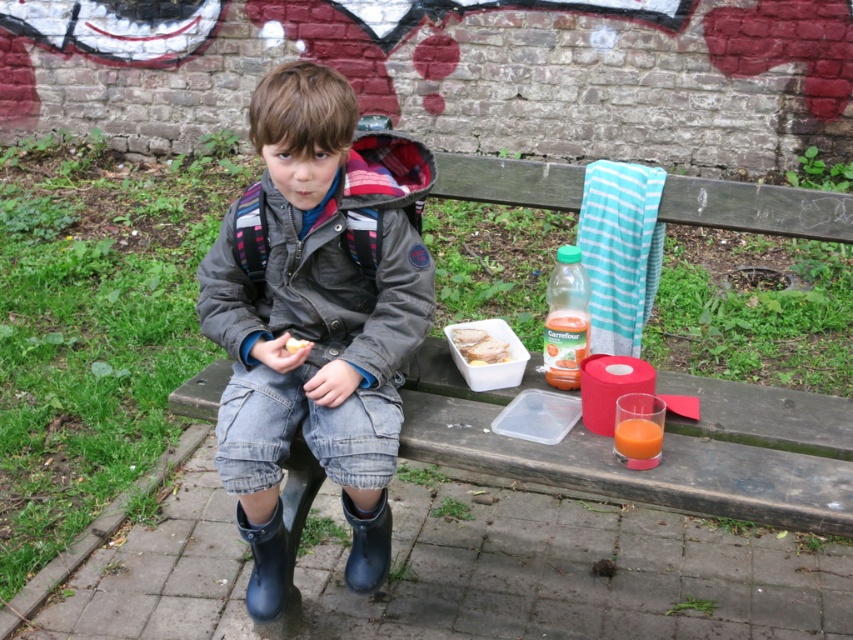
Question: Is rubber boot at lower center further to the viewer compared to white plastic sandwich at center?

Choices:
 (A) no
 (B) yes

Answer: (A)

Question: Is rubber boot at lower center positioned behind translucent plastic bottle at center?

Choices:
 (A) yes
 (B) no

Answer: (B)

Question: Considering the real-world distances, which object is farthest from the translucent plastic bottle at center?

Choices:
 (A) teal striped towel at upper right
 (B) rubber boot at lower center

Answer: (B)

Question: Does rubber boot at lower center have a greater width compared to white plastic sandwich at center?

Choices:
 (A) no
 (B) yes

Answer: (A)

Question: Which of the following is the closest to the observer?

Choices:
 (A) (368, 560)
 (B) (480, 353)
 (C) (549, 346)
 (D) (604, 168)

Answer: (C)

Question: Which object is the closest to the matte gray jacket at center?

Choices:
 (A) rubber boot at lower center
 (B) translucent plastic bottle at center
 (C) white plastic sandwich at center

Answer: (A)